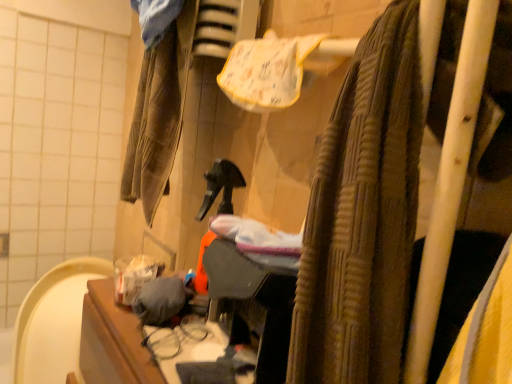
Identify the location of brown textured towel at upper right. (369, 204).

From a real-world perspective, which is physically below, brown corduroy pants at left, the first clothing positioned from the back, or gray fabric at center, which is counted as the 1th clothing, starting from the front?

In real-world perspective, gray fabric at center, which is counted as the 1th clothing, starting from the front, is lower.

From the image's perspective, is brown corduroy pants at left, the 2th clothing when ordered from front to back, above gray fabric at center, arranged as the 2th clothing when viewed from the back?

Yes, from the image's perspective, brown corduroy pants at left, the 2th clothing when ordered from front to back, is over gray fabric at center, arranged as the 2th clothing when viewed from the back.

At what (x,y) coordinates should I click in order to perform the action: click on clothing in front of the brown corduroy pants at left, the second clothing when ordered from bottom to top. Please return your answer as a coordinate pair (x, y). This screenshot has width=512, height=384. Looking at the image, I should click on (160, 300).

Would you say gray fabric at center, which is counted as the first clothing, starting from the bottom, contains brown corduroy pants at left, the first clothing positioned from the back?

Actually, brown corduroy pants at left, the first clothing positioned from the back, is outside gray fabric at center, which is counted as the first clothing, starting from the bottom.

Does gray fabric at center, which is counted as the first clothing, starting from the bottom, have a lesser width compared to brown corduroy pants at left, the first clothing in the top-to-bottom sequence?

Yes, gray fabric at center, which is counted as the first clothing, starting from the bottom, is thinner than brown corduroy pants at left, the first clothing in the top-to-bottom sequence.

Is gray fabric at center, the 2th clothing when ordered from top to bottom, oriented towards brown corduroy pants at left, the first clothing in the top-to-bottom sequence?

No, gray fabric at center, the 2th clothing when ordered from top to bottom, is not turned towards brown corduroy pants at left, the first clothing in the top-to-bottom sequence.

From a real-world perspective, who is located higher, brown corduroy pants at left, the second clothing when ordered from bottom to top, or brown textured towel at upper right?

brown corduroy pants at left, the second clothing when ordered from bottom to top, is physically above.

Is brown corduroy pants at left, the first clothing in the top-to-bottom sequence, facing away from brown textured towel at upper right?

brown corduroy pants at left, the first clothing in the top-to-bottom sequence, does not have its back to brown textured towel at upper right.

Does brown corduroy pants at left, the first clothing positioned from the back, appear on the right side of brown textured towel at upper right?

Incorrect, brown corduroy pants at left, the first clothing positioned from the back, is not on the right side of brown textured towel at upper right.

Can you confirm if brown textured towel at upper right is taller than gray fabric at center, the 2th clothing when ordered from top to bottom?

Correct, brown textured towel at upper right is much taller as gray fabric at center, the 2th clothing when ordered from top to bottom.

Which of these two, brown textured towel at upper right or gray fabric at center, the 2th clothing when ordered from top to bottom, is bigger?

Bigger between the two is brown textured towel at upper right.

Is brown textured towel at upper right not near gray fabric at center, which is counted as the 1th clothing, starting from the front?

They are positioned close to each other.

Does point (421, 128) come closer to viewer compared to point (158, 319)?

That is True.

Is brown textured towel at upper right not close to brown corduroy pants at left, the second clothing when ordered from bottom to top?

No, brown textured towel at upper right is in close proximity to brown corduroy pants at left, the second clothing when ordered from bottom to top.

Considering the sizes of brown textured towel at upper right and brown corduroy pants at left, the first clothing in the top-to-bottom sequence, in the image, is brown textured towel at upper right bigger or smaller than brown corduroy pants at left, the first clothing in the top-to-bottom sequence,?

brown textured towel at upper right is bigger than brown corduroy pants at left, the first clothing in the top-to-bottom sequence.

Is brown textured towel at upper right inside the boundaries of brown corduroy pants at left, the 2th clothing when ordered from front to back, or outside?

brown textured towel at upper right exists outside the volume of brown corduroy pants at left, the 2th clothing when ordered from front to back.

Is brown textured towel at upper right turned away from brown corduroy pants at left, the second clothing when ordered from bottom to top?

That's not correct — brown textured towel at upper right is not looking away from brown corduroy pants at left, the second clothing when ordered from bottom to top.

Are gray fabric at center, arranged as the 2th clothing when viewed from the back, and brown textured towel at upper right beside each other?

No, gray fabric at center, arranged as the 2th clothing when viewed from the back, is not making contact with brown textured towel at upper right.

Which is more to the left, gray fabric at center, which is counted as the 1th clothing, starting from the front, or brown textured towel at upper right?

gray fabric at center, which is counted as the 1th clothing, starting from the front, is more to the left.

Looking at this image, can we say gray fabric at center, which is counted as the first clothing, starting from the bottom, lies outside brown textured towel at upper right?

→ Yes.

From the image's perspective, is gray fabric at center, which is counted as the 1th clothing, starting from the front, over brown textured towel at upper right?

Actually, gray fabric at center, which is counted as the 1th clothing, starting from the front, appears below brown textured towel at upper right in the image.

At what (x,y) coordinates should I click in order to perform the action: click on clothing in front of the brown corduroy pants at left, the first clothing positioned from the back. Please return your answer as a coordinate pair (x, y). Looking at the image, I should click on (160, 300).

I want to click on clothing that appears above the gray fabric at center, the 2th clothing when ordered from top to bottom (from a real-world perspective), so click(158, 114).

Estimate the real-world distances between objects in this image. Which object is further from gray fabric at center, which is counted as the 1th clothing, starting from the front, brown corduroy pants at left, the 2th clothing when ordered from front to back, or brown textured towel at upper right?

brown corduroy pants at left, the 2th clothing when ordered from front to back, is positioned further to the anchor gray fabric at center, which is counted as the 1th clothing, starting from the front.

Estimate the real-world distances between objects in this image. Which object is closer to gray fabric at center, arranged as the 2th clothing when viewed from the back, brown textured towel at upper right or brown corduroy pants at left, the 2th clothing when ordered from front to back?

brown textured towel at upper right is closer to gray fabric at center, arranged as the 2th clothing when viewed from the back.

Which object lies further to the anchor point brown textured towel at upper right, brown corduroy pants at left, the second clothing when ordered from bottom to top, or gray fabric at center, the 2th clothing when ordered from top to bottom?

The object further to brown textured towel at upper right is brown corduroy pants at left, the second clothing when ordered from bottom to top.

From the image, which object appears to be nearer to brown corduroy pants at left, the first clothing in the top-to-bottom sequence, brown textured towel at upper right or gray fabric at center, which is counted as the 1th clothing, starting from the front?

gray fabric at center, which is counted as the 1th clothing, starting from the front, is closer to brown corduroy pants at left, the first clothing in the top-to-bottom sequence.

Based on the photo, from the image, which object appears to be farther from brown textured towel at upper right, gray fabric at center, which is counted as the 1th clothing, starting from the front, or brown corduroy pants at left, the second clothing when ordered from bottom to top?

Among the two, brown corduroy pants at left, the second clothing when ordered from bottom to top, is located further to brown textured towel at upper right.

Estimate the real-world distances between objects in this image. Which object is further from brown corduroy pants at left, the 2th clothing when ordered from front to back, gray fabric at center, which is counted as the 1th clothing, starting from the front, or brown textured towel at upper right?

Based on the image, brown textured towel at upper right appears to be further to brown corduroy pants at left, the 2th clothing when ordered from front to back.

Locate an element on the screen. The image size is (512, 384). clothing between brown textured towel at upper right and brown corduroy pants at left, the first clothing in the top-to-bottom sequence, from front to back is located at coordinates (160, 300).